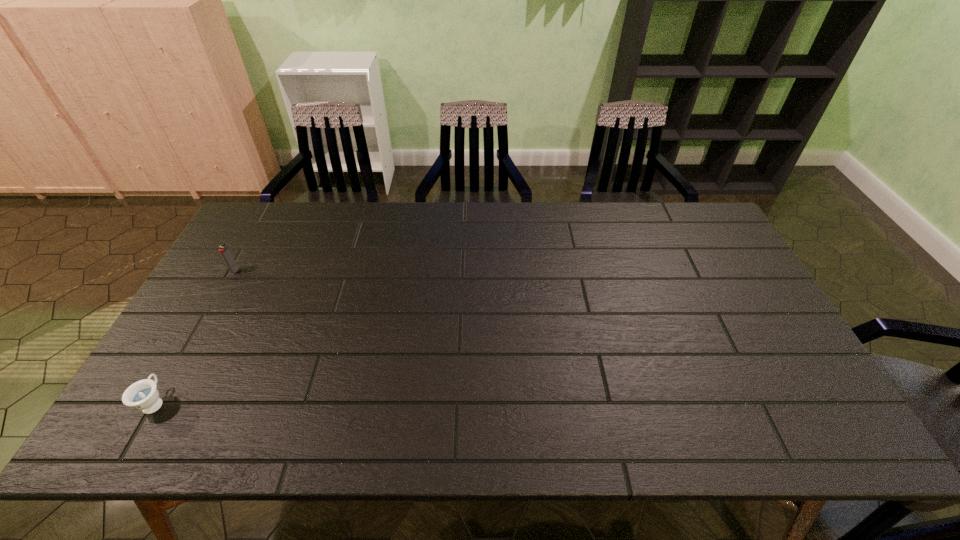
Locate an element on the screen. the taller object is located at coordinates (224, 250).

Where is `the farther object`? This screenshot has height=540, width=960. the farther object is located at coordinates (224, 250).

Find the location of a particular element. This screenshot has height=540, width=960. teacup is located at coordinates (143, 395).

Image resolution: width=960 pixels, height=540 pixels. I want to click on the nearer object, so click(x=143, y=395).

This screenshot has width=960, height=540. In order to click on vacant space located 0.320m on the back of the farther object in this screenshot , I will do `click(271, 206)`.

You are a GUI agent. You are given a task and a screenshot of the screen. Output one action in this format:
    pyautogui.click(x=<x>, y=<y>)
    Task: Click on the vacant point located on the side of the shorter object with the handle
    The width and height of the screenshot is (960, 540).
    Given the screenshot: What is the action you would take?
    pyautogui.click(x=188, y=345)

Where is `free spot located 0.380m on the side of the shorter object with the handle`? free spot located 0.380m on the side of the shorter object with the handle is located at coordinates (228, 275).

Locate an element on the screen. The height and width of the screenshot is (540, 960). vacant area located on the side of the shorter object with the handle is located at coordinates pos(188,345).

Locate an element on the screen. The height and width of the screenshot is (540, 960). object present at the near edge is located at coordinates tap(143, 395).

In order to click on igniter located at the left edge in this screenshot , I will do `click(224, 250)`.